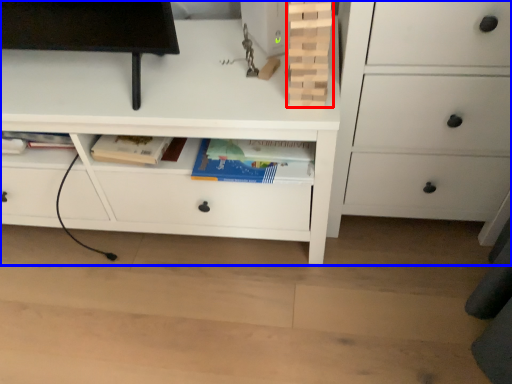
Question: Which object appears closest to the camera in this image, book (highlighted by a red box) or chest of drawers (highlighted by a blue box)?

Choices:
 (A) book
 (B) chest of drawers

Answer: (A)